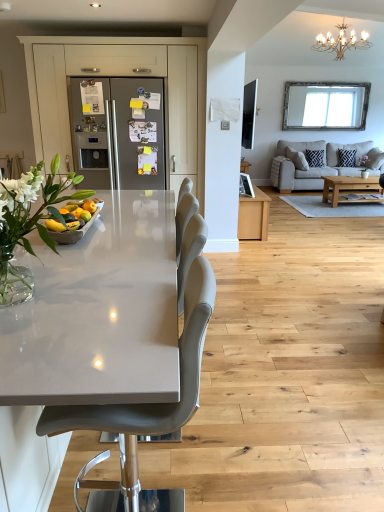
Question: Based on their sizes in the image, would you say matte gray chair at center is bigger or smaller than beige fabric couch at right?

Choices:
 (A) big
 (B) small

Answer: (B)

Question: Is point (43, 409) closer or farther from the camera than point (326, 174)?

Choices:
 (A) closer
 (B) farther

Answer: (A)

Question: Which is nearer to the beige fabric couch at right?

Choices:
 (A) oak wood coffee table at center
 (B) clear glass vase at center
 (C) black woven pillow at upper right, which is counted as the 1th pillow, starting from the left
 (D) gold metallic chandelier at upper right
 (E) navy blue textured cushion at center right, the 2th pillow from the left

Answer: (C)

Question: Which is farther from the satin silver refrigerator at center?

Choices:
 (A) oak wood coffee table at center
 (B) gold metallic chandelier at upper right
 (C) glossy white countertop at center
 (D) beige fabric couch at right
 (E) navy blue textured cushion at center right, the 2th pillow from the left

Answer: (E)